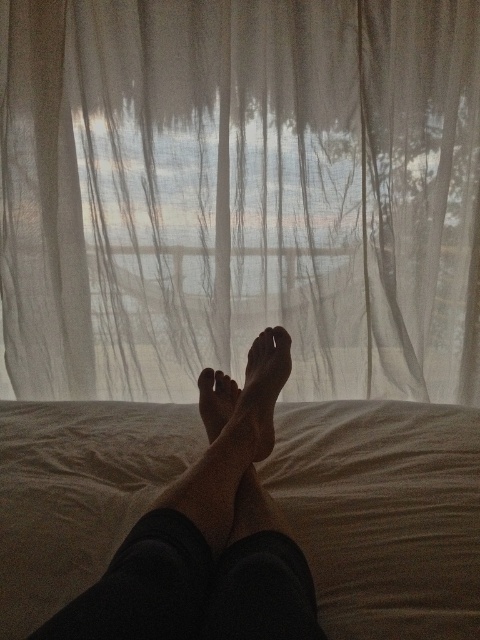
You are a photographer trying to capture the scene from the image. You want to ensure both the skinny bare feet at center and the smooth skin foot at center are clearly visible in your shot. Since the camera can only focus on one object at a time, which one should you focus on to ensure the other is still in the frame?

Since the skinny bare feet at center is positioned on the left side of smooth skin foot at center, you should focus on the smooth skin foot at center as it is on the right side, ensuring the left positioned skinny bare feet at center remains within the frame.

You are a photographer trying to capture the best angle of the skinny bare feet at center and the smooth skin foot at center. Since you want to highlight both feet equally in the photo, which foot should you move closer to the camera and why?

You should move the smooth skin foot at center closer to the camera because it is smaller in size than the skinny bare feet at center. This adjustment will help balance their sizes in the photo, ensuring both feet are highlighted equally.